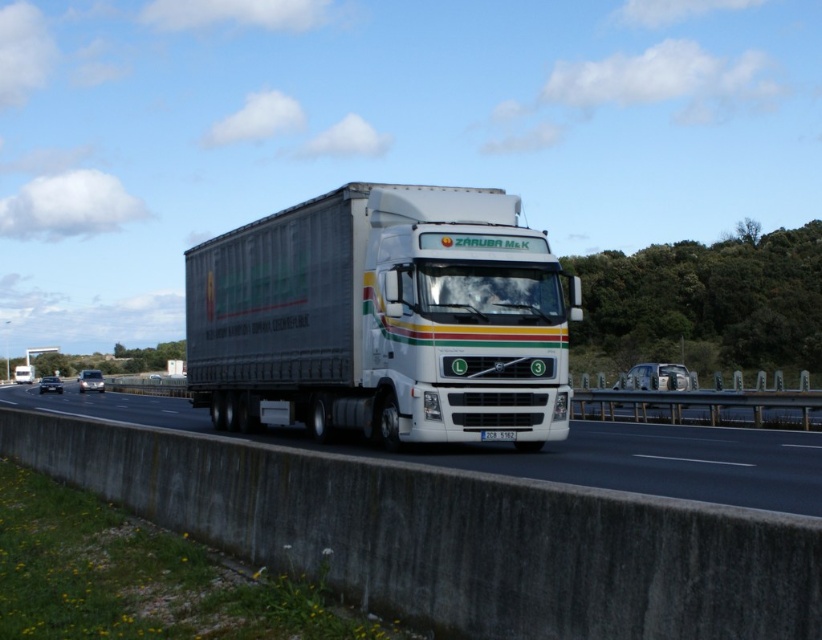
You are a driver approaching the white matte trailer truck at center on the highway. You notice the white concrete barrier at lower center. Is the barrier between you and the truck, or behind the truck?

The white concrete barrier at lower center is behind the white matte trailer truck at center, so the barrier is behind the truck.

You are a delivery driver who needs to pass under a bridge that has a height restriction of 4 meters. You are currently driving the white matte trailer truck at center and see the white concrete barrier at lower center. If the barrier is 3 meters tall, can you safely pass under the bridge?

The white matte trailer truck at center is taller than the white concrete barrier at lower center, which is 3 meters tall. Since the truck is taller than the barrier, it exceeds the 4 meters height restriction, so you cannot safely pass under the bridge.

You are standing at the camera position and want to reach the point at coordinates (269, 289). The semi truck is in your way. Can you walk around the truck on the left side? The highway has a concrete barrier on the left. Please consider the distance between the truck and the barrier.

The point at coordinates (269, 289) is 17.49 meters away from the camera. Since the highway has a concrete barrier on the left side, there is no space to walk around the truck on the left. You would need to go around the truck on the right side instead.